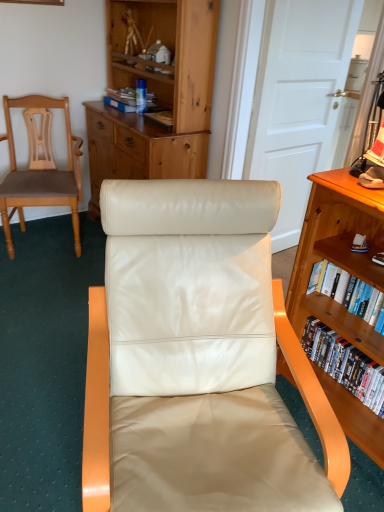
The image size is (384, 512). Find the location of `unoccupied area in front of matte brown wood chair at left, the second chair viewed from the right`. unoccupied area in front of matte brown wood chair at left, the second chair viewed from the right is located at coordinates (39, 291).